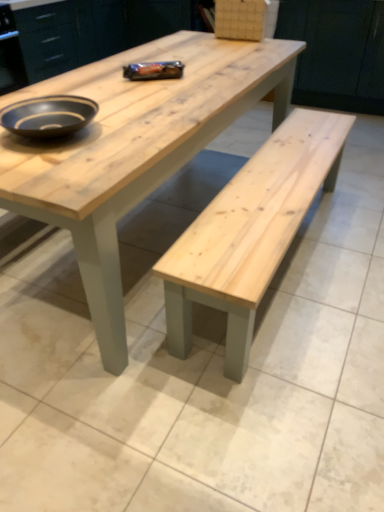
Measure the distance between natural wood cabinet at upper center, marked as the 1th cabinetry in a left-to-right arrangement, and camera.

9.84 feet.

Find the location of a particular element. The width and height of the screenshot is (384, 512). matte wood cabinet at upper center, which ranks as the second cabinetry in left-to-right order is located at coordinates (337, 53).

The height and width of the screenshot is (512, 384). What do you see at coordinates (48, 116) in the screenshot?
I see `matte black bowl at upper left` at bounding box center [48, 116].

Locate an element on the screen. natural wood bench at center is located at coordinates (134, 149).

This screenshot has width=384, height=512. What do you see at coordinates (134, 149) in the screenshot?
I see `natural wood bench at center` at bounding box center [134, 149].

The height and width of the screenshot is (512, 384). I want to click on natural wood cabinet at upper center, which is counted as the second cabinetry, starting from the right, so click(x=92, y=30).

From a real-world perspective, which is physically below, matte black bowl at upper left or matte wood cabinet at upper center, the first cabinetry when ordered from right to left?

matte wood cabinet at upper center, the first cabinetry when ordered from right to left, is physically lower.

At what (x,y) coordinates should I click in order to perform the action: click on the 2nd cabinetry directly beneath the matte black bowl at upper left (from a real-world perspective). Please return your answer as a coordinate pair (x, y). This screenshot has height=512, width=384. Looking at the image, I should click on (337, 53).

From the image's perspective, is matte black bowl at upper left positioned above or below matte wood cabinet at upper center, which ranks as the second cabinetry in left-to-right order?

From the image's perspective, matte black bowl at upper left appears below matte wood cabinet at upper center, which ranks as the second cabinetry in left-to-right order.

In the scene shown: Is matte wood cabinet at upper center, which ranks as the second cabinetry in left-to-right order, oriented towards natural wood cabinet at upper center, marked as the 1th cabinetry in a left-to-right arrangement?

No, matte wood cabinet at upper center, which ranks as the second cabinetry in left-to-right order, is not aimed at natural wood cabinet at upper center, marked as the 1th cabinetry in a left-to-right arrangement.

Considering the relative sizes of matte wood cabinet at upper center, the first cabinetry when ordered from right to left, and natural wood cabinet at upper center, marked as the 1th cabinetry in a left-to-right arrangement, in the image provided, is matte wood cabinet at upper center, the first cabinetry when ordered from right to left, wider than natural wood cabinet at upper center, marked as the 1th cabinetry in a left-to-right arrangement,?

Correct, the width of matte wood cabinet at upper center, the first cabinetry when ordered from right to left, exceeds that of natural wood cabinet at upper center, marked as the 1th cabinetry in a left-to-right arrangement.

Can you confirm if matte wood cabinet at upper center, the first cabinetry when ordered from right to left, is smaller than natural wood cabinet at upper center, marked as the 1th cabinetry in a left-to-right arrangement?

Correct, matte wood cabinet at upper center, the first cabinetry when ordered from right to left, occupies less space than natural wood cabinet at upper center, marked as the 1th cabinetry in a left-to-right arrangement.

Is matte wood cabinet at upper center, which ranks as the second cabinetry in left-to-right order, touching natural wood cabinet at upper center, marked as the 1th cabinetry in a left-to-right arrangement?

No, matte wood cabinet at upper center, which ranks as the second cabinetry in left-to-right order, is not next to natural wood cabinet at upper center, marked as the 1th cabinetry in a left-to-right arrangement.

From a real-world perspective, which cabinetry is the 2nd one underneath the matte black bowl at upper left? Please provide its 2D coordinates.

[(337, 53)]

How different are the orientations of matte wood cabinet at upper center, which ranks as the second cabinetry in left-to-right order, and matte black bowl at upper left in degrees?

matte wood cabinet at upper center, which ranks as the second cabinetry in left-to-right order, and matte black bowl at upper left are facing 179 degrees away from each other.

Does point (379, 53) lie behind point (1, 116)?

Yes, it is behind point (1, 116).

Looking at their sizes, would you say matte wood cabinet at upper center, which ranks as the second cabinetry in left-to-right order, is wider or thinner than matte black bowl at upper left?

Considering their sizes, matte wood cabinet at upper center, which ranks as the second cabinetry in left-to-right order, looks broader than matte black bowl at upper left.

Between natural wood cabinet at upper center, which is counted as the second cabinetry, starting from the right, and matte black bowl at upper left, which one appears on the right side from the viewer's perspective?

matte black bowl at upper left.

Is natural wood cabinet at upper center, which is counted as the second cabinetry, starting from the right, looking in the opposite direction of matte black bowl at upper left?

No, matte black bowl at upper left is not at the back of natural wood cabinet at upper center, which is counted as the second cabinetry, starting from the right.

From a real-world perspective, between natural wood cabinet at upper center, which is counted as the second cabinetry, starting from the right, and matte black bowl at upper left, who is vertically higher?

matte black bowl at upper left is physically above.

Find the location of a particular element. This screenshot has width=384, height=512. bowl on the right of natural wood cabinet at upper center, which is counted as the second cabinetry, starting from the right is located at coordinates (48, 116).

Does matte wood cabinet at upper center, which ranks as the second cabinetry in left-to-right order, have a lesser height compared to natural wood bench at center?

No.

Is matte wood cabinet at upper center, the first cabinetry when ordered from right to left, in front of or behind natural wood bench at center in the image?

matte wood cabinet at upper center, the first cabinetry when ordered from right to left, is behind natural wood bench at center.

Who is bigger, matte wood cabinet at upper center, which ranks as the second cabinetry in left-to-right order, or natural wood bench at center?

Bigger between the two is natural wood bench at center.

Which object is further away from the camera taking this photo, matte black bowl at upper left or natural wood cabinet at upper center, marked as the 1th cabinetry in a left-to-right arrangement?

natural wood cabinet at upper center, marked as the 1th cabinetry in a left-to-right arrangement, is further from the camera.

Is matte black bowl at upper left positioned with its back to natural wood cabinet at upper center, marked as the 1th cabinetry in a left-to-right arrangement?

matte black bowl at upper left does not have its back to natural wood cabinet at upper center, marked as the 1th cabinetry in a left-to-right arrangement.

Is matte black bowl at upper left inside or outside of natural wood cabinet at upper center, marked as the 1th cabinetry in a left-to-right arrangement?

matte black bowl at upper left is outside natural wood cabinet at upper center, marked as the 1th cabinetry in a left-to-right arrangement.

From a real-world perspective, relative to matte black bowl at upper left, is natural wood bench at center vertically above or below?

natural wood bench at center is situated lower than matte black bowl at upper left in the real world.

Does natural wood bench at center have a larger size compared to matte black bowl at upper left?

Indeed, natural wood bench at center has a larger size compared to matte black bowl at upper left.

Considering the positions of objects natural wood bench at center and matte black bowl at upper left in the image provided, who is behind, natural wood bench at center or matte black bowl at upper left?

matte black bowl at upper left.

What's the angular difference between natural wood bench at center and matte black bowl at upper left's facing directions?

The facing directions of natural wood bench at center and matte black bowl at upper left are 3.25 degrees apart.

The height and width of the screenshot is (512, 384). In order to click on bowl located in front of the matte wood cabinet at upper center, the first cabinetry when ordered from right to left in this screenshot , I will do `click(48, 116)`.

The width and height of the screenshot is (384, 512). Identify the location of cabinetry below the natural wood cabinet at upper center, marked as the 1th cabinetry in a left-to-right arrangement (from a real-world perspective). (337, 53).

Considering their positions, is matte wood cabinet at upper center, which ranks as the second cabinetry in left-to-right order, positioned further to natural wood bench at center than matte black bowl at upper left?

The object further to natural wood bench at center is matte wood cabinet at upper center, which ranks as the second cabinetry in left-to-right order.

When comparing their distances from matte wood cabinet at upper center, which ranks as the second cabinetry in left-to-right order, does natural wood cabinet at upper center, marked as the 1th cabinetry in a left-to-right arrangement, or natural wood bench at center seem closer?

Among the two, natural wood cabinet at upper center, marked as the 1th cabinetry in a left-to-right arrangement, is located nearer to matte wood cabinet at upper center, which ranks as the second cabinetry in left-to-right order.

Which object lies nearer to the anchor point natural wood bench at center, matte black bowl at upper left or natural wood cabinet at upper center, which is counted as the second cabinetry, starting from the right?

matte black bowl at upper left.

Estimate the real-world distances between objects in this image. Which object is further from matte wood cabinet at upper center, which ranks as the second cabinetry in left-to-right order, natural wood bench at center or natural wood cabinet at upper center, which is counted as the second cabinetry, starting from the right?

Among the two, natural wood bench at center is located further to matte wood cabinet at upper center, which ranks as the second cabinetry in left-to-right order.

Estimate the real-world distances between objects in this image. Which object is closer to natural wood cabinet at upper center, which is counted as the second cabinetry, starting from the right, matte black bowl at upper left or matte wood cabinet at upper center, which ranks as the second cabinetry in left-to-right order?

Among the two, matte wood cabinet at upper center, which ranks as the second cabinetry in left-to-right order, is located nearer to natural wood cabinet at upper center, which is counted as the second cabinetry, starting from the right.

Looking at the image, which one is located closer to matte black bowl at upper left, natural wood cabinet at upper center, marked as the 1th cabinetry in a left-to-right arrangement, or matte wood cabinet at upper center, which ranks as the second cabinetry in left-to-right order?

Based on the image, natural wood cabinet at upper center, marked as the 1th cabinetry in a left-to-right arrangement, appears to be nearer to matte black bowl at upper left.

Considering their positions, is matte wood cabinet at upper center, the first cabinetry when ordered from right to left, positioned further to matte black bowl at upper left than natural wood bench at center?

matte wood cabinet at upper center, the first cabinetry when ordered from right to left, lies further to matte black bowl at upper left than the other object.

Based on their spatial positions, is matte black bowl at upper left or natural wood cabinet at upper center, which is counted as the second cabinetry, starting from the right, closer to matte wood cabinet at upper center, which ranks as the second cabinetry in left-to-right order?

natural wood cabinet at upper center, which is counted as the second cabinetry, starting from the right, lies closer to matte wood cabinet at upper center, which ranks as the second cabinetry in left-to-right order, than the other object.

The height and width of the screenshot is (512, 384). I want to click on coffee table between natural wood cabinet at upper center, which is counted as the second cabinetry, starting from the right, and matte wood cabinet at upper center, which ranks as the second cabinetry in left-to-right order, from left to right, so click(x=134, y=149).

Locate an element on the screen. bowl between natural wood bench at center and matte wood cabinet at upper center, the first cabinetry when ordered from right to left, in the front-back direction is located at coordinates (48, 116).

Where is `bowl located between natural wood cabinet at upper center, which is counted as the second cabinetry, starting from the right, and matte wood cabinet at upper center, which ranks as the second cabinetry in left-to-right order, in the left-right direction`? bowl located between natural wood cabinet at upper center, which is counted as the second cabinetry, starting from the right, and matte wood cabinet at upper center, which ranks as the second cabinetry in left-to-right order, in the left-right direction is located at coordinates coord(48,116).

Locate an element on the screen. bowl between natural wood bench at center and natural wood cabinet at upper center, which is counted as the second cabinetry, starting from the right, from front to back is located at coordinates (48, 116).